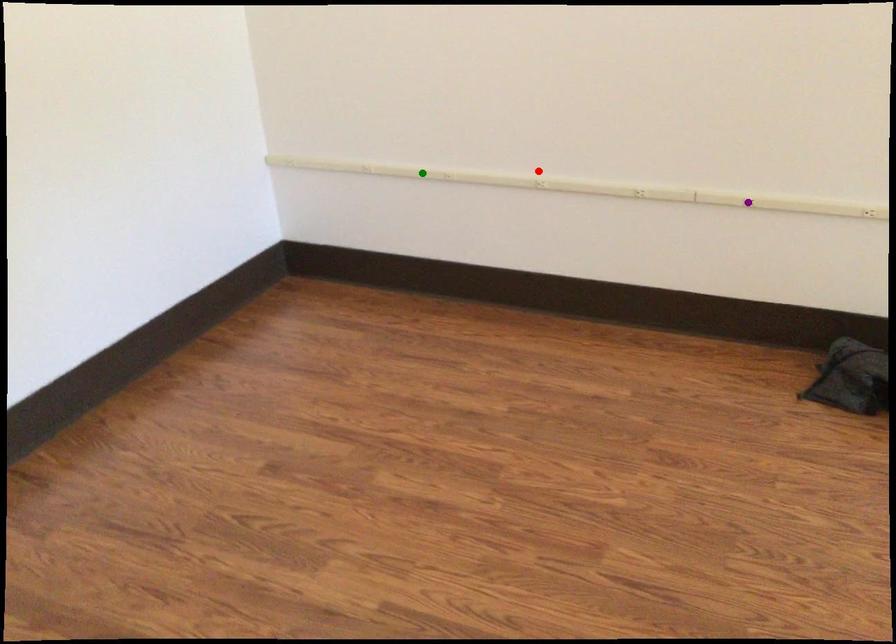
Based on the photo, order these from nearest to farthest:
green point
red point
purple point

purple point < red point < green point